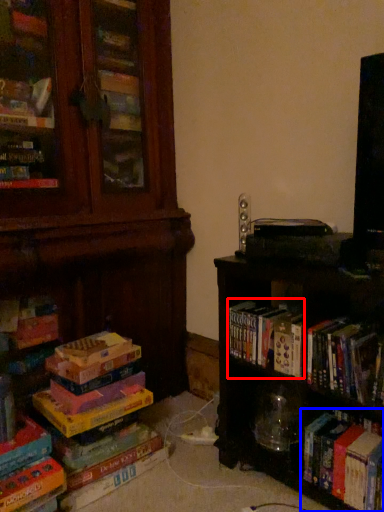
Question: Which object appears farthest to the camera in this image, book (highlighted by a red box) or book (highlighted by a blue box)?

Choices:
 (A) book
 (B) book

Answer: (A)